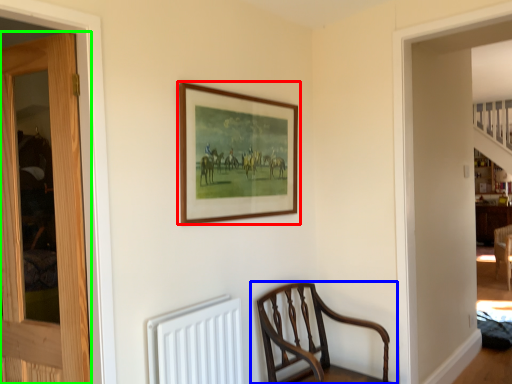
Question: Which object is the farthest from picture frame (highlighted by a red box)? Choose among these: chair (highlighted by a blue box) or door (highlighted by a green box).

Choices:
 (A) chair
 (B) door

Answer: (A)